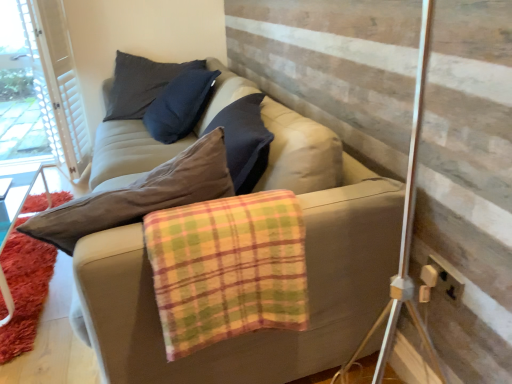
What is the approximate width of beige fabric couch at center?

beige fabric couch at center is 46.89 centimeters in width.

The width and height of the screenshot is (512, 384). Describe the element at coordinates (25, 289) in the screenshot. I see `shaggy orange rug at lower left` at that location.

What do you see at coordinates (227, 268) in the screenshot? I see `plaid flannel blanket at center` at bounding box center [227, 268].

Where is `plaid flannel blanket at center`? The image size is (512, 384). plaid flannel blanket at center is located at coordinates (227, 268).

You are a GUI agent. You are given a task and a screenshot of the screen. Output one action in this format:
    pyautogui.click(x=<x>, y=<y>)
    Task: Click on the beige plastic socket at lower right
    
    Given the screenshot: What is the action you would take?
    pyautogui.click(x=447, y=279)

What do you see at coordinates (63, 83) in the screenshot? The image size is (512, 384). I see `white textured barn door at upper left` at bounding box center [63, 83].

Measure the distance between point (67, 133) and camera.

The depth of point (67, 133) is 2.95 meters.

Where is `beige fabric couch at center`? Image resolution: width=512 pixels, height=384 pixels. beige fabric couch at center is located at coordinates (307, 269).

Looking at this image, in the image, is shaggy orange rug at lower left on the left side or the right side of white textured barn door at upper left?

shaggy orange rug at lower left is to the right of white textured barn door at upper left.

From the image's perspective, which is above, shaggy orange rug at lower left or white textured barn door at upper left?

white textured barn door at upper left is shown above in the image.

Based on the photo, could you tell me if shaggy orange rug at lower left is facing white textured barn door at upper left?

No, shaggy orange rug at lower left is not facing towards white textured barn door at upper left.

How much distance is there between shaggy orange rug at lower left and white textured barn door at upper left?

The distance of shaggy orange rug at lower left from white textured barn door at upper left is 36.47 inches.

Is plaid flannel blanket at center positioned before shaggy orange rug at lower left?

Yes.

From a real-world perspective, which is physically above, plaid flannel blanket at center or shaggy orange rug at lower left?

plaid flannel blanket at center.

From the image's perspective, between plaid flannel blanket at center and shaggy orange rug at lower left, which one is located above?

plaid flannel blanket at center.

In the scene shown: Which of these two, plaid flannel blanket at center or shaggy orange rug at lower left, stands shorter?

shaggy orange rug at lower left is shorter.

In the image, is plaid flannel blanket at center on the left side or the right side of beige fabric couch at center?

Clearly, plaid flannel blanket at center is on the right of beige fabric couch at center in the image.

Based on the photo, from the image's perspective, which object appears higher, plaid flannel blanket at center or beige fabric couch at center?

beige fabric couch at center.

Is plaid flannel blanket at center touching beige fabric couch at center?

No, plaid flannel blanket at center is not making contact with beige fabric couch at center.

From the picture: From the image's perspective, is plaid flannel blanket at center positioned above or below beige plastic socket at lower right?

Clearly, from the image's perspective, plaid flannel blanket at center is above beige plastic socket at lower right.

Is plaid flannel blanket at center oriented towards beige plastic socket at lower right?

No, plaid flannel blanket at center is not facing towards beige plastic socket at lower right.

Identify the location of electric outlet below the plaid flannel blanket at center (from the image's perspective). (447, 279).

Based on their positions, is plaid flannel blanket at center located to the left or right of beige plastic socket at lower right?

plaid flannel blanket at center is positioned on beige plastic socket at lower right's left side.

Does plaid flannel blanket at center turn towards white textured barn door at upper left?

No, plaid flannel blanket at center does not turn towards white textured barn door at upper left.

Considering the sizes of plaid flannel blanket at center and white textured barn door at upper left in the image, is plaid flannel blanket at center bigger or smaller than white textured barn door at upper left?

In the image, plaid flannel blanket at center appears to be smaller than white textured barn door at upper left.

Considering the sizes of objects plaid flannel blanket at center and white textured barn door at upper left in the image provided, who is wider, plaid flannel blanket at center or white textured barn door at upper left?

white textured barn door at upper left.

How far apart are beige fabric couch at center and shaggy orange rug at lower left?

beige fabric couch at center and shaggy orange rug at lower left are 1.10 meters apart.

Considering the relative sizes of beige fabric couch at center and shaggy orange rug at lower left in the image provided, is beige fabric couch at center thinner than shaggy orange rug at lower left?

Incorrect, the width of beige fabric couch at center is not less than that of shaggy orange rug at lower left.

Considering the positions of point (316, 361) and point (0, 297), is point (316, 361) closer or farther from the camera than point (0, 297)?

Point (316, 361) is positioned closer to the camera compared to point (0, 297).

From the image's perspective, which one is positioned higher, beige fabric couch at center or shaggy orange rug at lower left?

beige fabric couch at center.

Which object is further away from the camera, shaggy orange rug at lower left or beige fabric couch at center?

shaggy orange rug at lower left is more distant.

From a real-world perspective, which is physically below, shaggy orange rug at lower left or beige fabric couch at center?

From a 3D spatial view, shaggy orange rug at lower left is below.

From the image's perspective, which one is positioned lower, shaggy orange rug at lower left or beige fabric couch at center?

shaggy orange rug at lower left.

Is shaggy orange rug at lower left taller or shorter than beige fabric couch at center?

Clearly, shaggy orange rug at lower left is shorter compared to beige fabric couch at center.

Image resolution: width=512 pixels, height=384 pixels. I want to click on barn door above the shaggy orange rug at lower left (from a real-world perspective), so pyautogui.click(x=63, y=83).

The image size is (512, 384). Identify the location of mat below the plaid flannel blanket at center (from a real-world perspective). (25, 289).

Estimate the real-world distances between objects in this image. Which object is closer to shaggy orange rug at lower left, beige plastic socket at lower right or beige fabric couch at center?

Based on the image, beige fabric couch at center appears to be nearer to shaggy orange rug at lower left.

Considering their positions, is shaggy orange rug at lower left positioned closer to white textured barn door at upper left than plaid flannel blanket at center?

shaggy orange rug at lower left.

Estimate the real-world distances between objects in this image. Which object is further from plaid flannel blanket at center, beige fabric couch at center or white textured barn door at upper left?

The object further to plaid flannel blanket at center is white textured barn door at upper left.

Considering their positions, is shaggy orange rug at lower left positioned closer to plaid flannel blanket at center than beige plastic socket at lower right?

beige plastic socket at lower right lies closer to plaid flannel blanket at center than the other object.

Looking at the image, which one is located further to beige fabric couch at center, white textured barn door at upper left or plaid flannel blanket at center?

Based on the image, white textured barn door at upper left appears to be further to beige fabric couch at center.

Estimate the real-world distances between objects in this image. Which object is closer to shaggy orange rug at lower left, white textured barn door at upper left or beige fabric couch at center?

white textured barn door at upper left is positioned closer to the anchor shaggy orange rug at lower left.

Which object lies nearer to the anchor point beige plastic socket at lower right, beige fabric couch at center or plaid flannel blanket at center?

The object closer to beige plastic socket at lower right is beige fabric couch at center.

Looking at the image, which one is located further to white textured barn door at upper left, plaid flannel blanket at center or beige fabric couch at center?

plaid flannel blanket at center is further to white textured barn door at upper left.

Image resolution: width=512 pixels, height=384 pixels. I want to click on studio couch between shaggy orange rug at lower left and beige plastic socket at lower right from left to right, so click(307, 269).

Identify the location of studio couch situated between shaggy orange rug at lower left and plaid flannel blanket at center from left to right. The height and width of the screenshot is (384, 512). pyautogui.click(x=307, y=269).

This screenshot has height=384, width=512. In order to click on blanket between shaggy orange rug at lower left and beige plastic socket at lower right in this screenshot , I will do `click(227, 268)`.

Image resolution: width=512 pixels, height=384 pixels. Identify the location of blanket between beige fabric couch at center and white textured barn door at upper left along the z-axis. (227, 268).